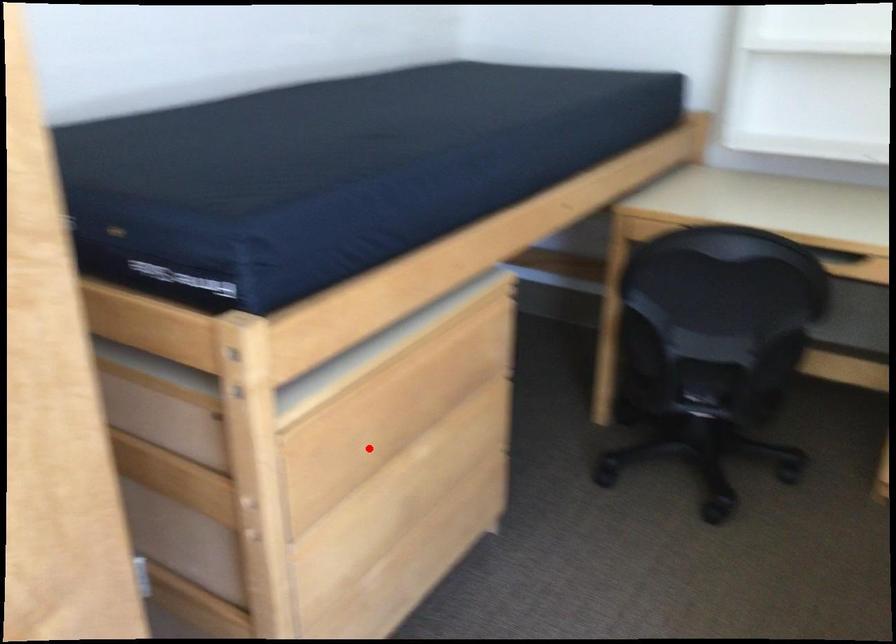
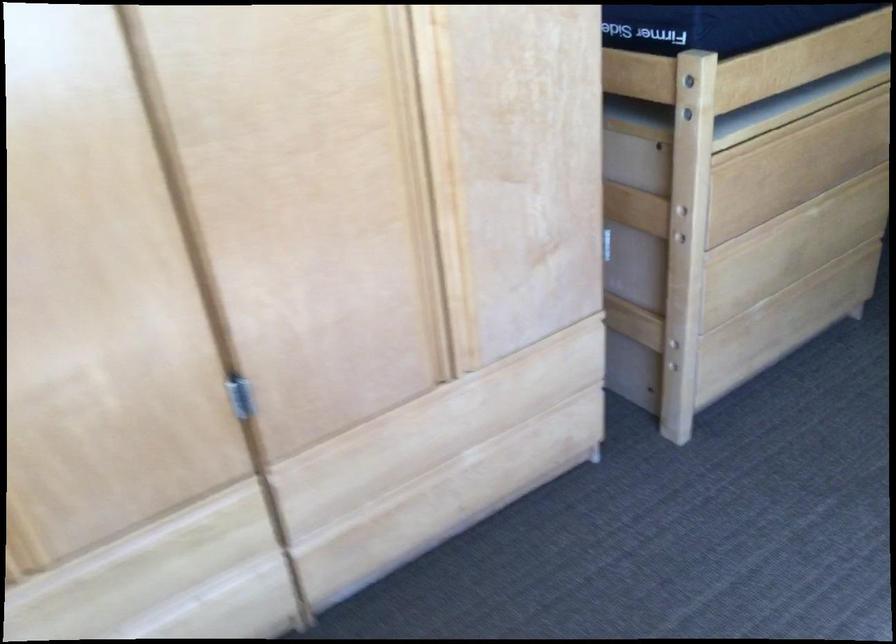
Question: I am providing you with two images of the same scene from different viewpoints. A red point is shown in image1. For the corresponding object point in image2, is it positioned nearer or farther from the camera?

Choices:
 (A) Nearer
 (B) Farther

Answer: (B)